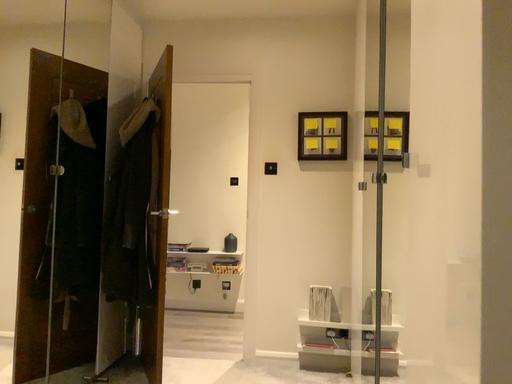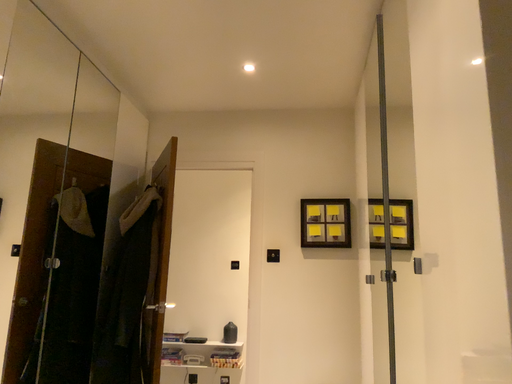
Question: How did the camera likely rotate when shooting the video?

Choices:
 (A) rotated upward
 (B) rotated downward

Answer: (A)